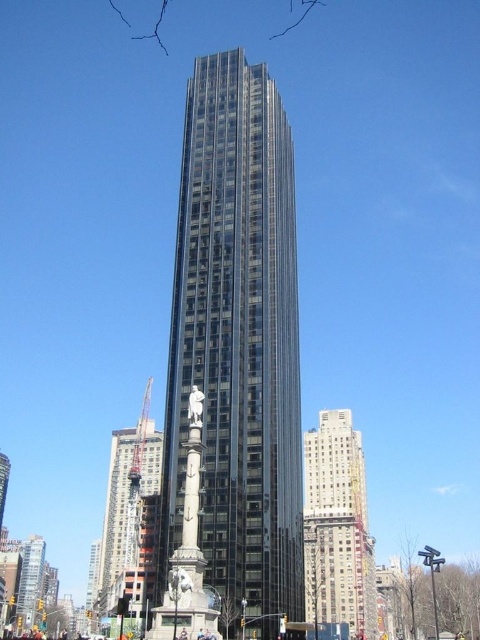
Question: Does shiny glass tower at center have a greater width compared to brick textured building at center?

Choices:
 (A) yes
 (B) no

Answer: (B)

Question: Which of the following is the closest to the observer?

Choices:
 (A) (304, 464)
 (B) (255, 458)

Answer: (B)

Question: Can you confirm if shiny glass tower at center is positioned to the right of brick textured building at center?

Choices:
 (A) no
 (B) yes

Answer: (A)

Question: Which point is closer to the camera taking this photo?

Choices:
 (A) (115, 557)
 (B) (351, 588)
 (C) (272, 579)

Answer: (C)

Question: Which object is the farthest from the brick textured building at center?

Choices:
 (A) metallic glass construction at center
 (B) shiny glass tower at center

Answer: (B)

Question: Does shiny glass tower at center appear under brick textured building at center?

Choices:
 (A) no
 (B) yes

Answer: (A)